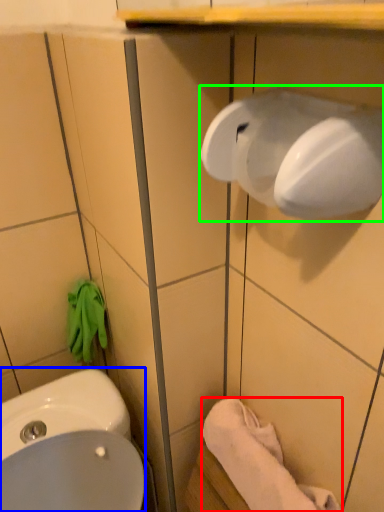
Question: Which object is the closest to the towel/napkin (highlighted by a red box)? Choose among these: sink (highlighted by a blue box) or hand dryer (highlighted by a green box).

Choices:
 (A) sink
 (B) hand dryer

Answer: (A)